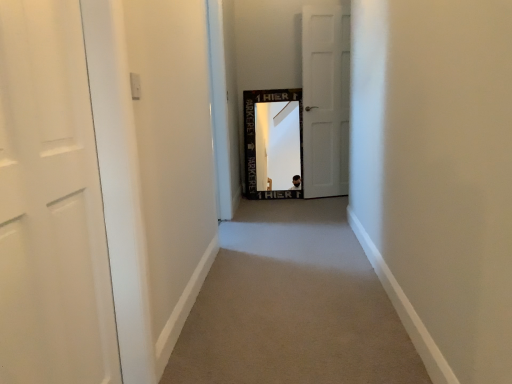
Question: Does white matte door at center, the 1th door from the back, have a larger size compared to carpet at center?

Choices:
 (A) yes
 (B) no

Answer: (B)

Question: From the image's perspective, would you say white matte door at center, the first door from the right, is shown under carpet at center?

Choices:
 (A) no
 (B) yes

Answer: (A)

Question: Is the depth of white matte door at center, placed as the second door when sorted from front to back, less than that of carpet at center?

Choices:
 (A) no
 (B) yes

Answer: (A)

Question: From a real-world perspective, is white matte door at center, the first door from the right, physically above carpet at center?

Choices:
 (A) no
 (B) yes

Answer: (B)

Question: Is white matte door at center, the 1th door from the back, oriented towards carpet at center?

Choices:
 (A) yes
 (B) no

Answer: (B)

Question: Is carpet at center spatially inside white matte door at center, the 1th door from the back, or outside of it?

Choices:
 (A) inside
 (B) outside

Answer: (B)

Question: Considering the positions of carpet at center and white matte door at center, which is the second door in left-to-right order, in the image, is carpet at center wider or thinner than white matte door at center, which is the second door in left-to-right order,?

Choices:
 (A) thin
 (B) wide

Answer: (B)

Question: Considering the positions of point (305, 297) and point (312, 127), is point (305, 297) closer or farther from the camera than point (312, 127)?

Choices:
 (A) closer
 (B) farther

Answer: (A)

Question: In the image, is carpet at center on the left side or the right side of white matte door at center, which is the second door in left-to-right order?

Choices:
 (A) left
 (B) right

Answer: (A)

Question: From a real-world perspective, is white matte door at left, positioned as the 2th door in back-to-front order, positioned above or below white matte door at center, the first door from the right?

Choices:
 (A) below
 (B) above

Answer: (A)

Question: Is white matte door at left, which appears as the second door when viewed from the right, inside or outside of white matte door at center, the first door from the right?

Choices:
 (A) outside
 (B) inside

Answer: (A)

Question: From the image's perspective, is white matte door at left, marked as the 1th door in a front-to-back arrangement, positioned above or below white matte door at center, placed as the second door when sorted from front to back?

Choices:
 (A) above
 (B) below

Answer: (B)

Question: Is white matte door at left, arranged as the 1th door when viewed from the left, taller or shorter than white matte door at center, the 1th door from the back?

Choices:
 (A) tall
 (B) short

Answer: (B)

Question: Considering their positions, is carpet at center located in front of or behind white matte door at left, positioned as the 2th door in back-to-front order?

Choices:
 (A) behind
 (B) front

Answer: (A)

Question: Is point (310, 339) positioned closer to the camera than point (73, 145)?

Choices:
 (A) farther
 (B) closer

Answer: (A)